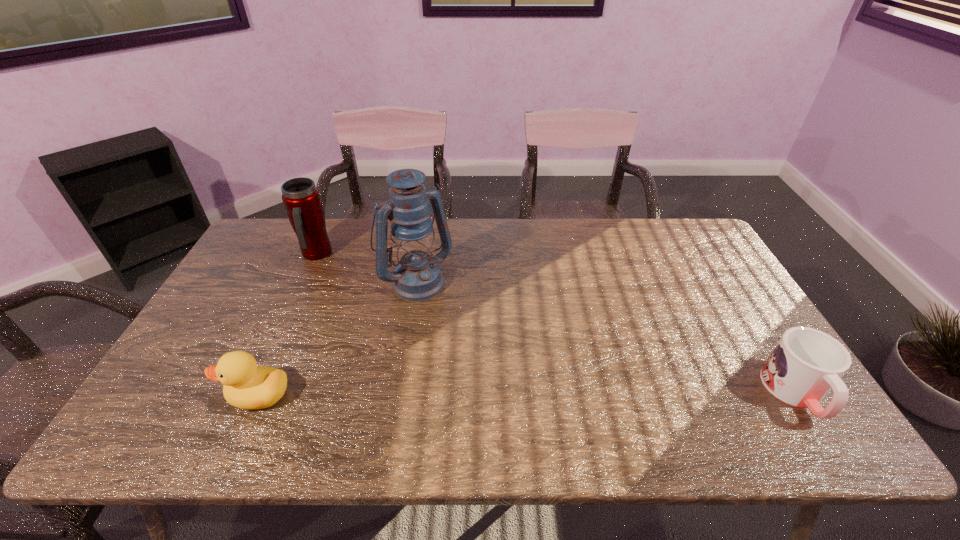
I want to click on vacant space at the far edge, so click(474, 218).

This screenshot has height=540, width=960. In the image, there is a desktop. Identify the location of vacant space at the near edge. (423, 390).

You are a GUI agent. You are given a task and a screenshot of the screen. Output one action in this format:
    pyautogui.click(x=<x>, y=<y>)
    Task: Click on the blank space at the left edge
    The width and height of the screenshot is (960, 540).
    Given the screenshot: What is the action you would take?
    pyautogui.click(x=241, y=327)

The width and height of the screenshot is (960, 540). I want to click on vacant position at the right edge of the desktop, so click(x=741, y=330).

Find the location of a particular element. vacant area between the duck and the mug is located at coordinates (527, 394).

Locate an element on the screen. The height and width of the screenshot is (540, 960). free area in between the second tallest object and the mug is located at coordinates (556, 324).

At what (x,y) coordinates should I click in order to perform the action: click on empty space that is in between the third object from left to right and the rightmost object. Please return your answer as a coordinate pair (x, y). Image resolution: width=960 pixels, height=540 pixels. Looking at the image, I should click on (606, 336).

The width and height of the screenshot is (960, 540). In order to click on vacant space that's between the mug and the thermos bottle in this screenshot , I will do `click(556, 324)`.

I want to click on free spot between the lantern and the thermos bottle, so click(x=366, y=267).

What are the coordinates of `unoccupied area between the duck and the tallest object` in the screenshot? It's located at (337, 338).